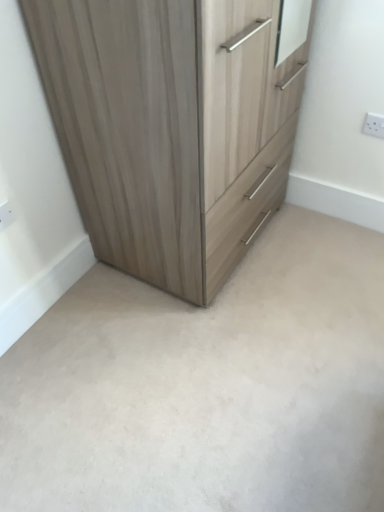
Question: Which is correct: white plastic electric outlet at lower left, which is the second electric outlet in back-to-front order, is inside beige carpet at center, or outside of it?

Choices:
 (A) outside
 (B) inside

Answer: (A)

Question: From their relative heights in the image, would you say white plastic electric outlet at lower left, positioned as the 1th electric outlet in front-to-back order, is taller or shorter than beige carpet at center?

Choices:
 (A) tall
 (B) short

Answer: (A)

Question: Which of these objects is positioned farthest from the beige carpet at center?

Choices:
 (A) light wood/texture chest of drawers at upper left
 (B) white plastic electric outlet at upper right, placed as the 2th electric outlet when sorted from bottom to top
 (C) white plastic electric outlet at lower left, positioned as the 1th electric outlet in front-to-back order

Answer: (B)

Question: Which object is the farthest from the beige carpet at center?

Choices:
 (A) white plastic electric outlet at lower left, which is the 1th electric outlet in left-to-right order
 (B) white plastic electric outlet at upper right, the 1th electric outlet positioned from the top
 (C) light wood/texture chest of drawers at upper left

Answer: (B)